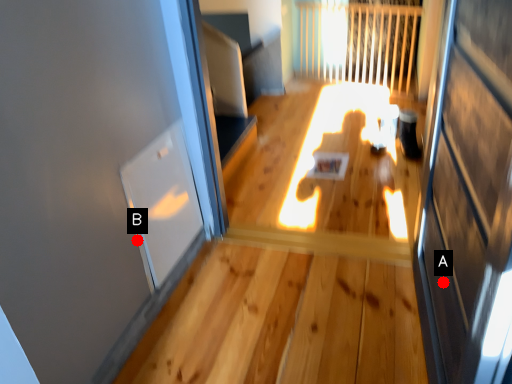
Question: Two points are circled on the image, labeled by A and B beside each circle. Which point is closer to the camera?

Choices:
 (A) A is closer
 (B) B is closer

Answer: (A)